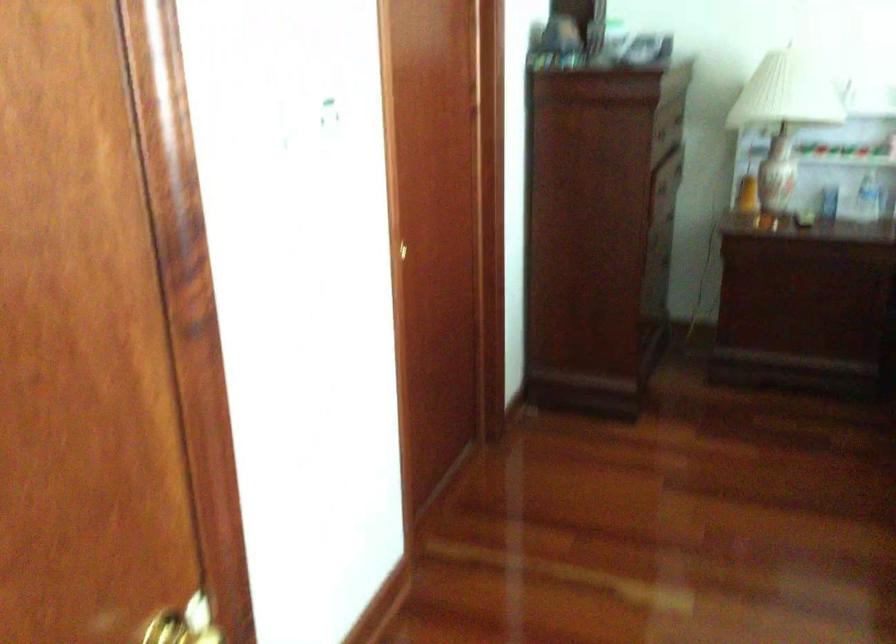
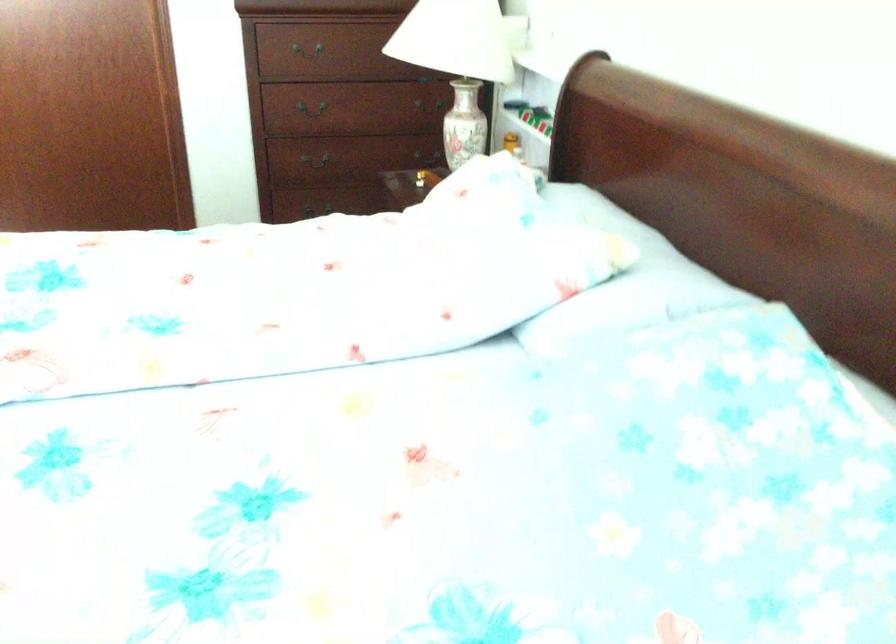
Locate, in the second image, the point that corresponds to pixel 600 146 in the first image.

(309, 52)